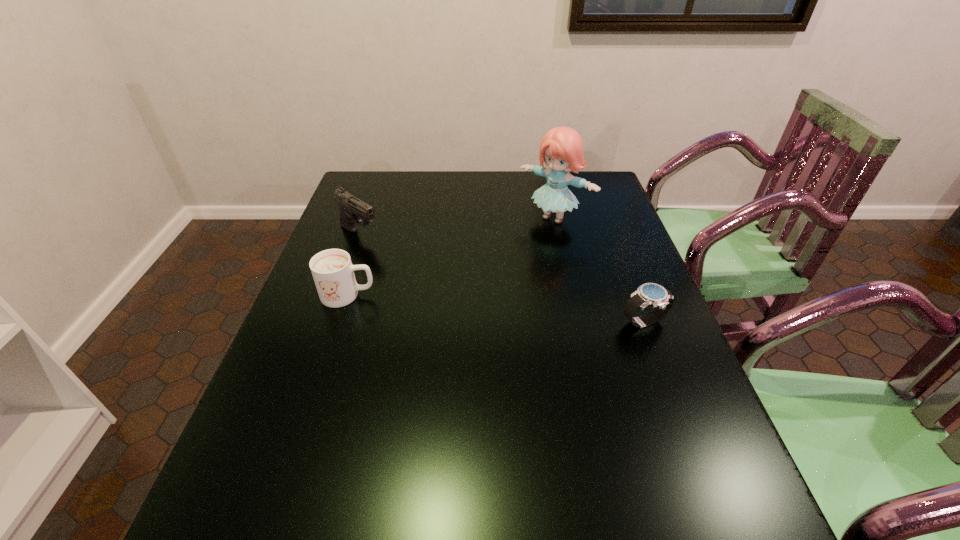
Locate an element on the screen. The image size is (960, 540). empty space that is in between the third farthest object and the doll is located at coordinates (451, 256).

This screenshot has height=540, width=960. I want to click on vacant area that lies between the cappuccino and the pistol, so click(x=354, y=265).

I want to click on vacant area between the watch and the doll, so [x=599, y=270].

Identify which object is the second nearest to the second tallest object. Please provide its 2D coordinates. Your answer should be formatted as a tuple, i.e. [(x, y)], where the tuple contains the x and y coordinates of a point satisfying the conditions above.

[(561, 148)]

Identify the location of the second closest object to the watch. The image size is (960, 540). (332, 270).

Locate an element on the screen. This screenshot has width=960, height=540. vacant space that satisfies the following two spatial constraints: 1. on the front side of the tallest object; 2. on the left side of the nearest object is located at coordinates (578, 322).